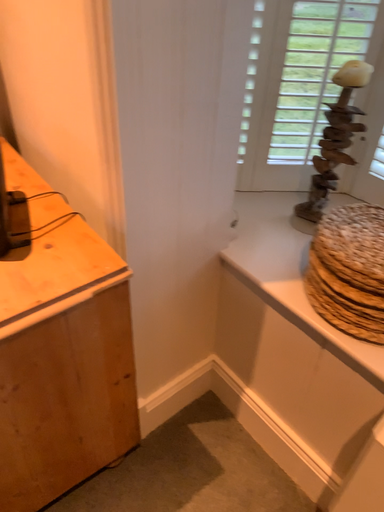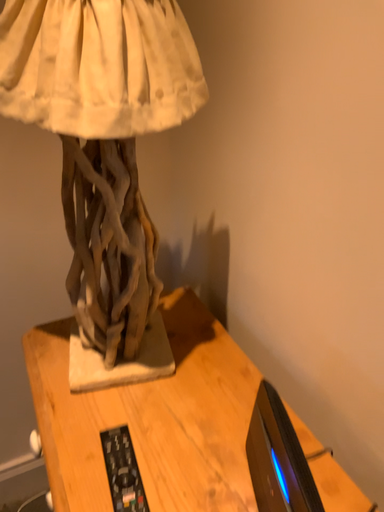
Question: Which way did the camera rotate in the video?

Choices:
 (A) rotated downward
 (B) rotated upward

Answer: (B)